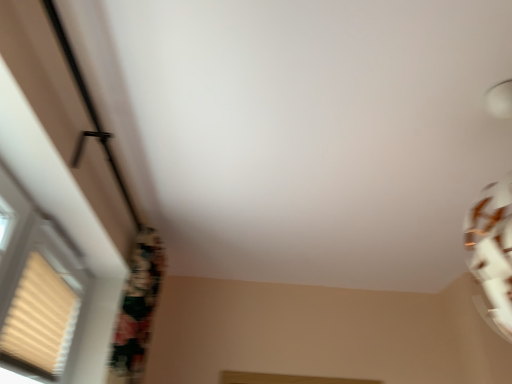
Where is `beige textured window at left`? The width and height of the screenshot is (512, 384). beige textured window at left is located at coordinates (36, 288).

Image resolution: width=512 pixels, height=384 pixels. What do you see at coordinates (36, 288) in the screenshot? I see `beige textured window at left` at bounding box center [36, 288].

Measure the distance between point (74, 301) and camera.

The depth of point (74, 301) is 1.89 meters.

This screenshot has height=384, width=512. I want to click on beige textured window at left, so 36,288.